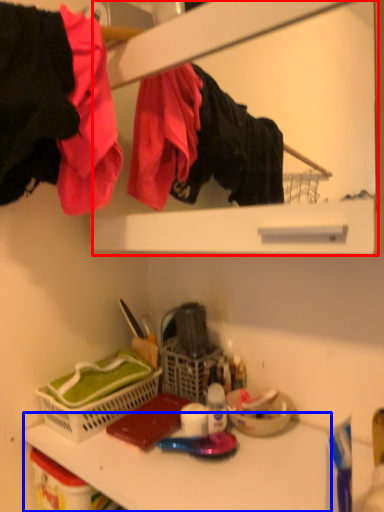
Question: Which of the following is the farthest to the observer, medicine cabinet (highlighted by a red box) or counter top (highlighted by a blue box)?

Choices:
 (A) medicine cabinet
 (B) counter top

Answer: (A)